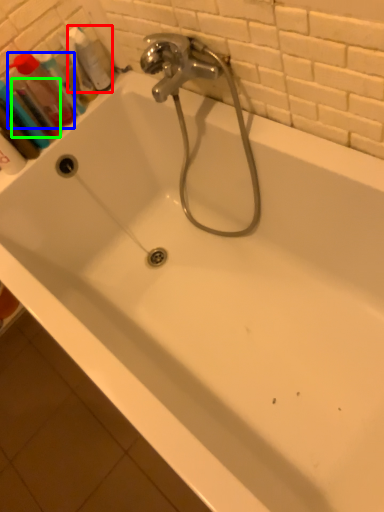
Question: Which is nearer to the cleaning product (highlighted by a red box)? mouthwash (highlighted by a blue box) or mouthwash (highlighted by a green box).

Choices:
 (A) mouthwash
 (B) mouthwash

Answer: (A)